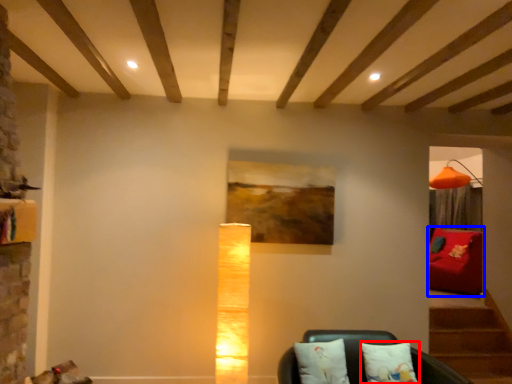
Question: Which object appears closest to the camera in this image, pillow (highlighted by a red box) or furniture (highlighted by a blue box)?

Choices:
 (A) pillow
 (B) furniture

Answer: (A)